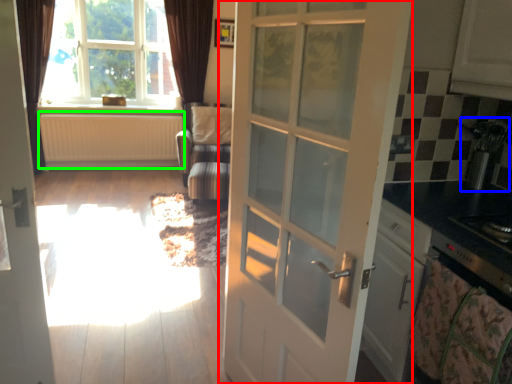
Question: Considering the real-world distances, which object is farthest from door (highlighted by a red box)? appliance (highlighted by a blue box) or radiator (highlighted by a green box)?

Choices:
 (A) appliance
 (B) radiator

Answer: (B)